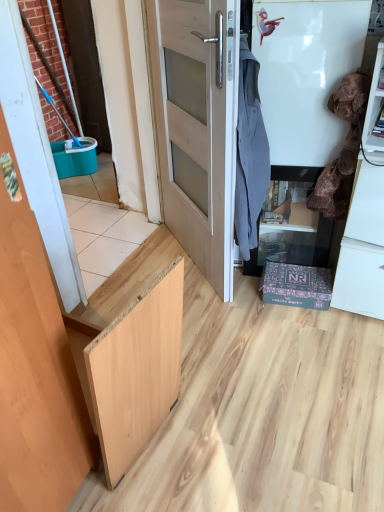
Describe the element at coordinates (249, 155) in the screenshot. Image resolution: width=384 pixels, height=512 pixels. I see `gray fabric shirt at upper right, acting as the 1th laundry starting from the left` at that location.

At what (x,y) coordinates should I click in order to perform the action: click on matte black cabinet at lower right. Please return your answer as a coordinate pair (x, y). This screenshot has height=512, width=384. Looking at the image, I should click on (295, 173).

How much space does light wood door at center, which is counted as the 2th door, starting from the left, occupy vertically?

light wood door at center, which is counted as the 2th door, starting from the left, is 4.08 feet tall.

The height and width of the screenshot is (512, 384). In order to click on gray fabric shirt at upper right, acting as the 1th laundry starting from the left in this screenshot , I will do `click(249, 155)`.

Is there a large distance between gray fabric shirt at upper right, acting as the 1th laundry starting from the left, and light wood door at center, which is counted as the 2th door, starting from the left?

No, gray fabric shirt at upper right, acting as the 1th laundry starting from the left, is not far from light wood door at center, which is counted as the 2th door, starting from the left.

Is gray fabric shirt at upper right, acting as the 1th laundry starting from the left, further to the viewer compared to light wood door at center, the 1th door viewed from the right?

Yes, gray fabric shirt at upper right, acting as the 1th laundry starting from the left, is behind light wood door at center, the 1th door viewed from the right.

Is gray fabric shirt at upper right, the second laundry in the right-to-left sequence, looking in the opposite direction of light wood door at center, the first door viewed from the back?

gray fabric shirt at upper right, the second laundry in the right-to-left sequence, does not have its back to light wood door at center, the first door viewed from the back.

From the picture: From the image's perspective, is gray fabric shirt at upper right, the second laundry in the right-to-left sequence, beneath light wood door at center, which appears as the second door when viewed from the front?

Correct, gray fabric shirt at upper right, the second laundry in the right-to-left sequence, appears lower than light wood door at center, which appears as the second door when viewed from the front, in the image.

Can you confirm if light wood door at center, the first door viewed from the back, is bigger than gray fabric shirt at upper right, the second laundry in the right-to-left sequence?

Indeed, light wood door at center, the first door viewed from the back, has a larger size compared to gray fabric shirt at upper right, the second laundry in the right-to-left sequence.

Would you say light wood door at center, the 1th door viewed from the right, is a long distance from gray fabric shirt at upper right, the second laundry in the right-to-left sequence?

Actually, light wood door at center, the 1th door viewed from the right, and gray fabric shirt at upper right, the second laundry in the right-to-left sequence, are a little close together.

Is light wood door at center, which appears as the second door when viewed from the front, to the right of gray fabric shirt at upper right, acting as the 1th laundry starting from the left, from the viewer's perspective?

Incorrect, light wood door at center, which appears as the second door when viewed from the front, is not on the right side of gray fabric shirt at upper right, acting as the 1th laundry starting from the left.

Considering the relative sizes of light wood door at center, the first door viewed from the back, and gray fabric shirt at upper right, acting as the 1th laundry starting from the left, in the image provided, is light wood door at center, the first door viewed from the back, shorter than gray fabric shirt at upper right, acting as the 1th laundry starting from the left,?

In fact, light wood door at center, the first door viewed from the back, may be taller than gray fabric shirt at upper right, acting as the 1th laundry starting from the left.

In the scene shown: From their relative heights in the image, would you say velvet brown laundry at right, marked as the 2th laundry in a left-to-right arrangement, is taller or shorter than wooden door at left, the 2th door from the back?

In the image, velvet brown laundry at right, marked as the 2th laundry in a left-to-right arrangement, appears to be shorter than wooden door at left, the 2th door from the back.

Does velvet brown laundry at right, marked as the 2th laundry in a left-to-right arrangement, turn towards wooden door at left, the 2th door from the back?

No, velvet brown laundry at right, marked as the 2th laundry in a left-to-right arrangement, is not oriented towards wooden door at left, the 2th door from the back.

Which is closer, (353, 175) or (51, 350)?

The point (51, 350) is more forward.

Which is more to the left, velvet brown laundry at right, marked as the 2th laundry in a left-to-right arrangement, or wooden door at left, the 2th door from the back?

wooden door at left, the 2th door from the back, is more to the left.

Would you say velvet brown laundry at right, acting as the first laundry starting from the right, is part of matte black cabinet at lower right's contents?

No, velvet brown laundry at right, acting as the first laundry starting from the right, is not inside matte black cabinet at lower right.

Could you tell me if matte black cabinet at lower right is turned towards velvet brown laundry at right, acting as the first laundry starting from the right?

No, matte black cabinet at lower right is not oriented towards velvet brown laundry at right, acting as the first laundry starting from the right.

The image size is (384, 512). What are the coordinates of `cabinetry behind the velvet brown laundry at right, acting as the first laundry starting from the right` in the screenshot? It's located at (295, 173).

Are light wood door at center, which is counted as the 2th door, starting from the left, and wooden door at left, the second door positioned from the right, making contact?

light wood door at center, which is counted as the 2th door, starting from the left, and wooden door at left, the second door positioned from the right, are not in contact.

Which object is closer to the camera, light wood door at center, the 1th door viewed from the right, or wooden door at left, acting as the 1th door starting from the front?

Positioned in front is wooden door at left, acting as the 1th door starting from the front.

Looking at this image, from a real-world perspective, which is physically above, light wood door at center, which appears as the second door when viewed from the front, or wooden door at left, acting as the 1th door starting from the front?

In real-world perspective, wooden door at left, acting as the 1th door starting from the front, is above.

Which is behind, point (228, 166) or point (16, 312)?

The point (228, 166) is behind.

Which object is further away from the camera, gray fabric shirt at upper right, acting as the 1th laundry starting from the left, or matte black cabinet at lower right?

matte black cabinet at lower right is more distant.

Between gray fabric shirt at upper right, the second laundry in the right-to-left sequence, and matte black cabinet at lower right, which one has less height?

With less height is matte black cabinet at lower right.

Are gray fabric shirt at upper right, acting as the 1th laundry starting from the left, and matte black cabinet at lower right far apart?

No, gray fabric shirt at upper right, acting as the 1th laundry starting from the left, is not far away from matte black cabinet at lower right.

Does gray fabric shirt at upper right, the second laundry in the right-to-left sequence, have a greater width compared to matte black cabinet at lower right?

Correct, the width of gray fabric shirt at upper right, the second laundry in the right-to-left sequence, exceeds that of matte black cabinet at lower right.

Would you say light wood door at center, the 1th door viewed from the right, is inside or outside velvet brown laundry at right, acting as the first laundry starting from the right?

light wood door at center, the 1th door viewed from the right, is located beyond the bounds of velvet brown laundry at right, acting as the first laundry starting from the right.

How far apart are light wood door at center, the first door viewed from the back, and velvet brown laundry at right, acting as the first laundry starting from the right?

light wood door at center, the first door viewed from the back, and velvet brown laundry at right, acting as the first laundry starting from the right, are 21.52 inches apart from each other.

Is light wood door at center, which is counted as the 2th door, starting from the left, in front of or behind velvet brown laundry at right, marked as the 2th laundry in a left-to-right arrangement, in the image?

Clearly, light wood door at center, which is counted as the 2th door, starting from the left, is in front of velvet brown laundry at right, marked as the 2th laundry in a left-to-right arrangement.

Is light wood door at center, the first door viewed from the back, smaller than velvet brown laundry at right, acting as the first laundry starting from the right?

Incorrect, light wood door at center, the first door viewed from the back, is not smaller in size than velvet brown laundry at right, acting as the first laundry starting from the right.

Which laundry is the 1st one when counting from the right side of the light wood door at center, which is counted as the 2th door, starting from the left? Please provide its 2D coordinates.

[(249, 155)]

The image size is (384, 512). What are the coordinates of `the 1st laundry above the light wood door at center, the 1th door viewed from the right (from a real-world perspective)` in the screenshot? It's located at (249, 155).

When comparing their distances from velvet brown laundry at right, acting as the first laundry starting from the right, does light wood door at center, which appears as the second door when viewed from the front, or gray fabric shirt at upper right, the second laundry in the right-to-left sequence, seem further?

Based on the image, light wood door at center, which appears as the second door when viewed from the front, appears to be further to velvet brown laundry at right, acting as the first laundry starting from the right.

Considering their positions, is matte black cabinet at lower right positioned closer to wooden door at left, the second door positioned from the right, than light wood door at center, the 1th door viewed from the right?

The object closer to wooden door at left, the second door positioned from the right, is light wood door at center, the 1th door viewed from the right.

Which object lies further to the anchor point velvet brown laundry at right, marked as the 2th laundry in a left-to-right arrangement, gray fabric shirt at upper right, acting as the 1th laundry starting from the left, or light wood door at center, which is counted as the 2th door, starting from the left?

light wood door at center, which is counted as the 2th door, starting from the left, is positioned further to the anchor velvet brown laundry at right, marked as the 2th laundry in a left-to-right arrangement.

Estimate the real-world distances between objects in this image. Which object is closer to wooden door at left, the second door positioned from the right, light wood door at center, the first door viewed from the back, or matte black cabinet at lower right?

Based on the image, light wood door at center, the first door viewed from the back, appears to be nearer to wooden door at left, the second door positioned from the right.

From the image, which object appears to be nearer to matte black cabinet at lower right, wooden door at left, which is counted as the first door, starting from the left, or velvet brown laundry at right, acting as the first laundry starting from the right?

velvet brown laundry at right, acting as the first laundry starting from the right.

Looking at the image, which one is located closer to velvet brown laundry at right, acting as the first laundry starting from the right, wooden door at left, the second door positioned from the right, or matte black cabinet at lower right?

Based on the image, matte black cabinet at lower right appears to be nearer to velvet brown laundry at right, acting as the first laundry starting from the right.

Consider the image. From the image, which object appears to be nearer to light wood door at center, which is counted as the 2th door, starting from the left, velvet brown laundry at right, acting as the first laundry starting from the right, or matte black cabinet at lower right?

The object closer to light wood door at center, which is counted as the 2th door, starting from the left, is matte black cabinet at lower right.

Which object lies further to the anchor point matte black cabinet at lower right, gray fabric shirt at upper right, acting as the 1th laundry starting from the left, or wooden door at left, which is counted as the first door, starting from the left?

wooden door at left, which is counted as the first door, starting from the left.

This screenshot has height=512, width=384. In order to click on door between wooden door at left, the second door positioned from the right, and matte black cabinet at lower right, along the z-axis in this screenshot , I will do `click(198, 127)`.

I want to click on laundry located between gray fabric shirt at upper right, the second laundry in the right-to-left sequence, and matte black cabinet at lower right in the depth direction, so click(x=343, y=148).

The image size is (384, 512). Find the location of `door between wooden door at left, the 2th door from the back, and gray fabric shirt at upper right, the second laundry in the right-to-left sequence, in the front-back direction`. door between wooden door at left, the 2th door from the back, and gray fabric shirt at upper right, the second laundry in the right-to-left sequence, in the front-back direction is located at coordinates (198, 127).

I want to click on cabinetry between light wood door at center, which is counted as the 2th door, starting from the left, and velvet brown laundry at right, acting as the first laundry starting from the right, so click(295, 173).